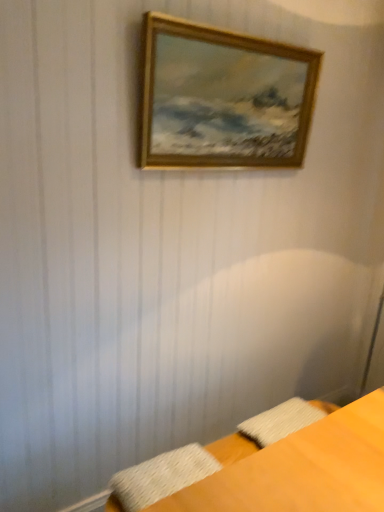
At what (x,y) coordinates should I click in order to perform the action: click on gold wooden picture frame at upper center. Please return your answer as a coordinate pair (x, y). Looking at the image, I should click on (223, 97).

This screenshot has width=384, height=512. What do you see at coordinates (223, 97) in the screenshot?
I see `gold wooden picture frame at upper center` at bounding box center [223, 97].

Where is `gold wooden picture frame at upper center`? The height and width of the screenshot is (512, 384). gold wooden picture frame at upper center is located at coordinates (223, 97).